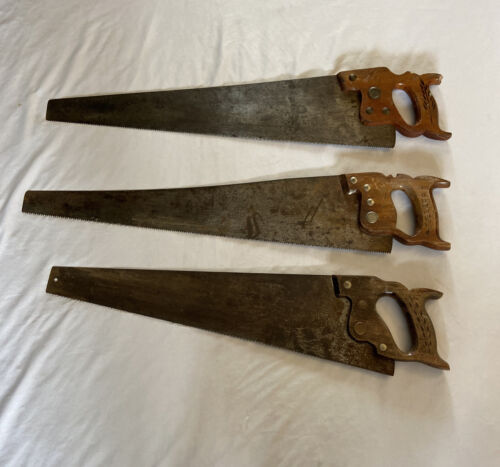
Where is `handles`? This screenshot has width=500, height=467. handles is located at coordinates (431, 325), (433, 216), (427, 122).